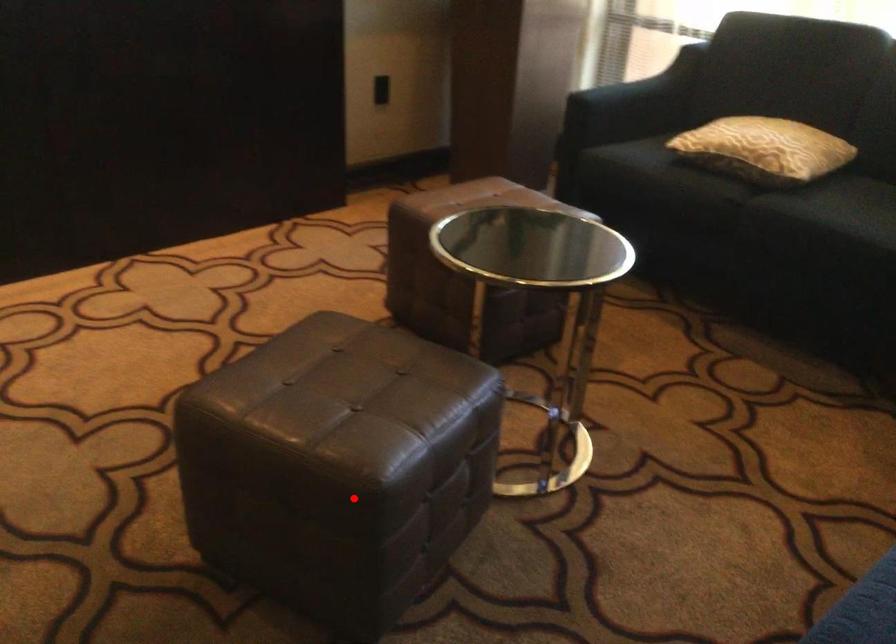
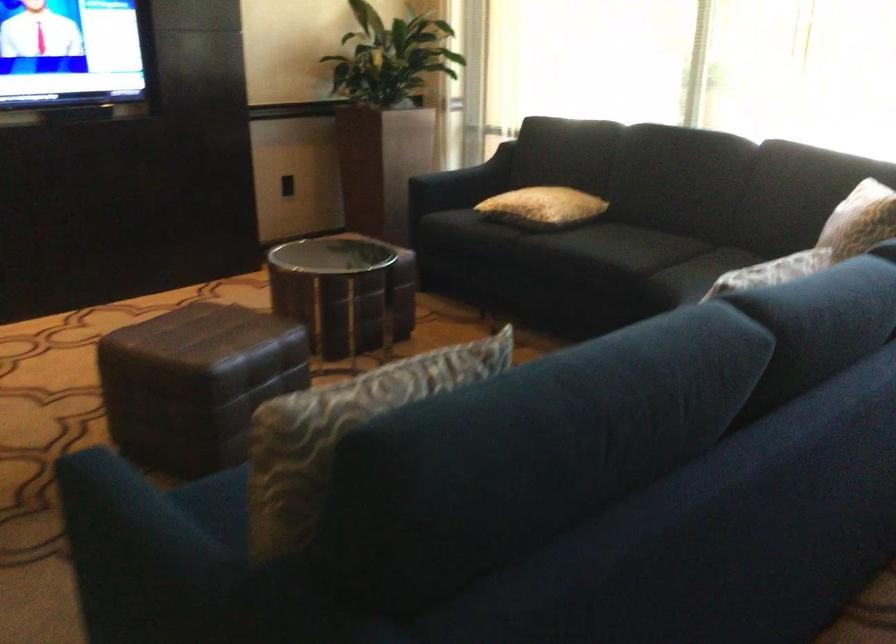
Question: I am providing you with two images of the same scene from different viewpoints. In image1, a red point is highlighted. Considering the same 3D point in image2, which of the following is correct?

Choices:
 (A) It is closer
 (B) It is farther

Answer: (B)